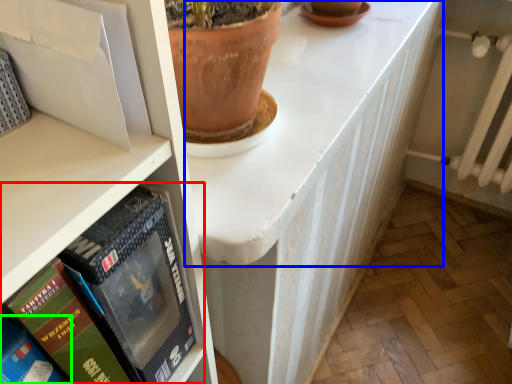
Question: Which is nearer to the book (highlighted by a red box)? counter top (highlighted by a blue box) or book (highlighted by a green box).

Choices:
 (A) counter top
 (B) book

Answer: (B)